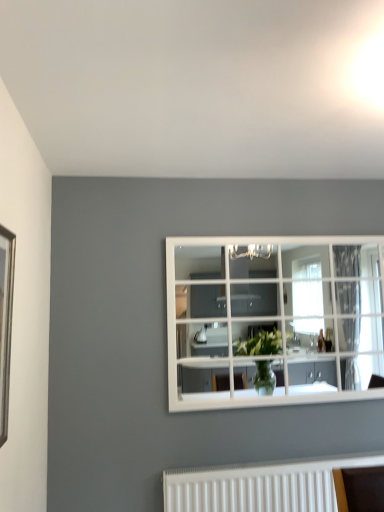
Question: Should I look upward or downward to see wooden picture frame at left?

Choices:
 (A) up
 (B) down

Answer: (B)